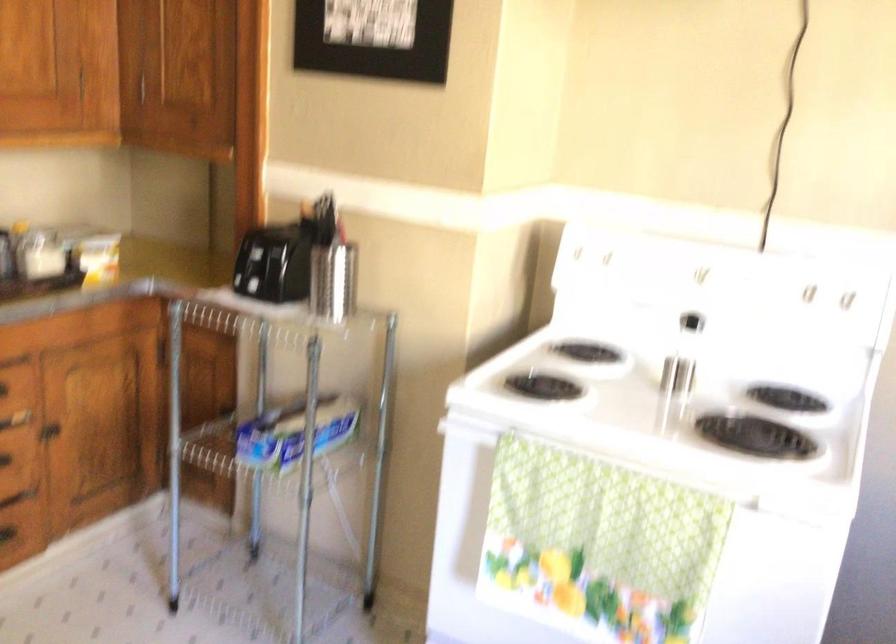
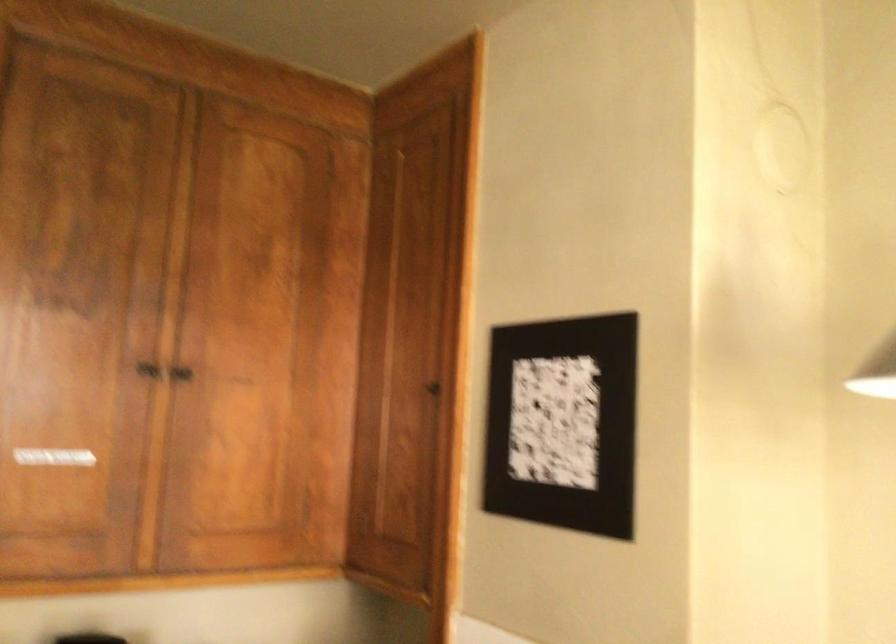
The first image is from the beginning of the video and the second image is from the end. How did the camera likely rotate when shooting the video?

The camera rotated toward left-up.